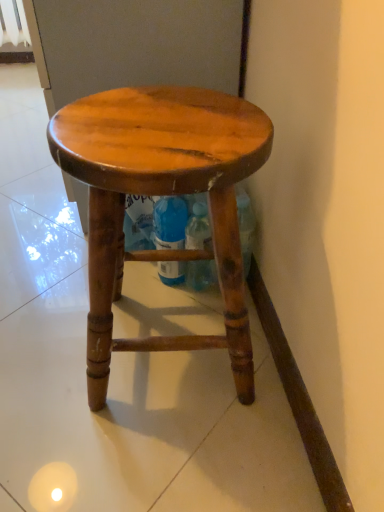
I want to click on vacant space underneath wooden stool at center (from a real-world perspective), so click(x=166, y=351).